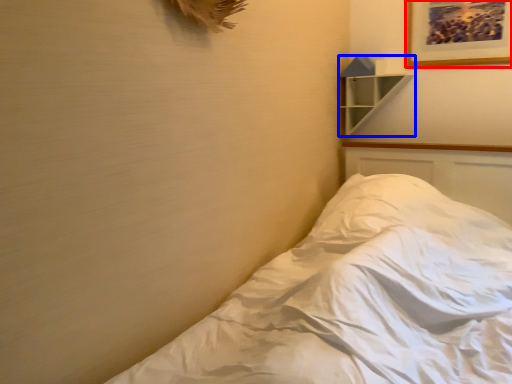
Question: Among these objects, which one is farthest to the camera, picture frame (highlighted by a red box) or shelf (highlighted by a blue box)?

Choices:
 (A) picture frame
 (B) shelf

Answer: (B)